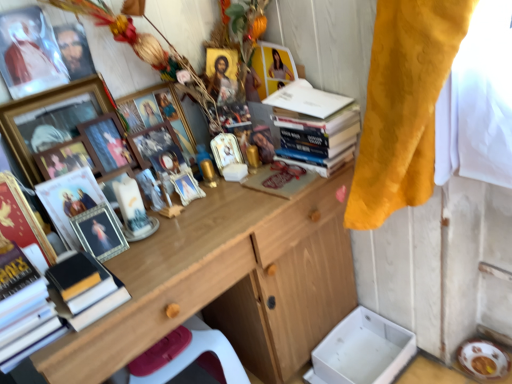
I want to click on vacant area that lies in front of matte glass picture frame at center, which appears as the sixth picture frame when viewed from the left, so click(148, 261).